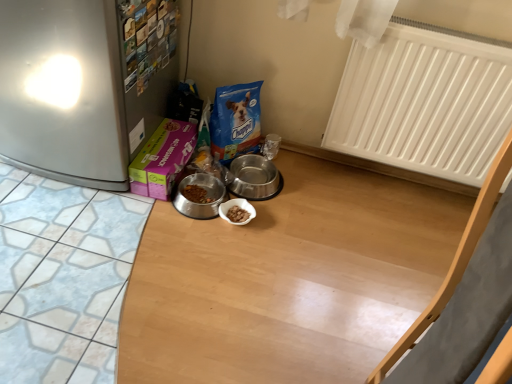
Question: Can you confirm if metallic stainless steel bowl at center, which appears as the first appliance when viewed from the right, is bigger than white matte radiator at upper right?

Choices:
 (A) yes
 (B) no

Answer: (B)

Question: Does metallic stainless steel bowl at center, positioned as the 2th appliance in left-to-right order, have a greater height compared to white matte radiator at upper right?

Choices:
 (A) no
 (B) yes

Answer: (A)

Question: Could you tell me if metallic stainless steel bowl at center, positioned as the 2th appliance in left-to-right order, is facing white matte radiator at upper right?

Choices:
 (A) yes
 (B) no

Answer: (B)

Question: Is metallic stainless steel bowl at center, which appears as the first appliance when viewed from the right, at the left side of white matte radiator at upper right?

Choices:
 (A) no
 (B) yes

Answer: (B)

Question: From a real-world perspective, is metallic stainless steel bowl at center, which appears as the first appliance when viewed from the right, physically below white matte radiator at upper right?

Choices:
 (A) no
 (B) yes

Answer: (B)

Question: Is metallic stainless steel bowl at center, which appears as the first appliance when viewed from the right, not within white matte radiator at upper right?

Choices:
 (A) yes
 (B) no

Answer: (A)

Question: Can you confirm if brushed metal fridge at left is shorter than metallic stainless steel bowl at center, which appears as the first appliance when viewed from the right?

Choices:
 (A) yes
 (B) no

Answer: (B)

Question: Can you confirm if brushed metal fridge at left is thinner than metallic stainless steel bowl at center, which appears as the first appliance when viewed from the right?

Choices:
 (A) yes
 (B) no

Answer: (B)

Question: Is brushed metal fridge at left at the left side of metallic stainless steel bowl at center, positioned as the 2th appliance in left-to-right order?

Choices:
 (A) yes
 (B) no

Answer: (A)

Question: From the image's perspective, is brushed metal fridge at left located above metallic stainless steel bowl at center, positioned as the 2th appliance in left-to-right order?

Choices:
 (A) yes
 (B) no

Answer: (A)

Question: From a real-world perspective, is brushed metal fridge at left positioned over metallic stainless steel bowl at center, positioned as the 2th appliance in left-to-right order, based on gravity?

Choices:
 (A) no
 (B) yes

Answer: (B)

Question: Is metallic stainless steel bowl at center, positioned as the 2th appliance in left-to-right order, at the back of brushed metal fridge at left?

Choices:
 (A) yes
 (B) no

Answer: (B)

Question: Is metallic stainless steel bowl at center, which appears as the first appliance when viewed from the right, positioned in front of brushed metal fridge at left?

Choices:
 (A) no
 (B) yes

Answer: (A)